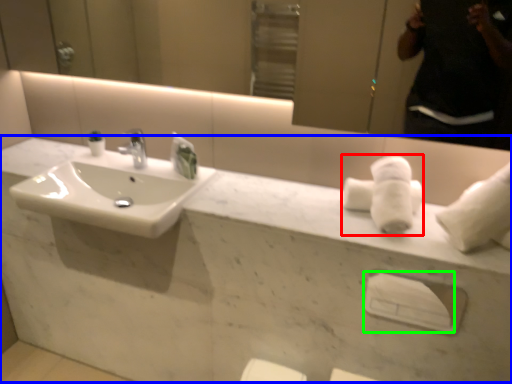
Question: Which is farther away from bath towel (highlighted by a red box)? counter top (highlighted by a blue box) or towel bar (highlighted by a green box)?

Choices:
 (A) counter top
 (B) towel bar

Answer: (A)